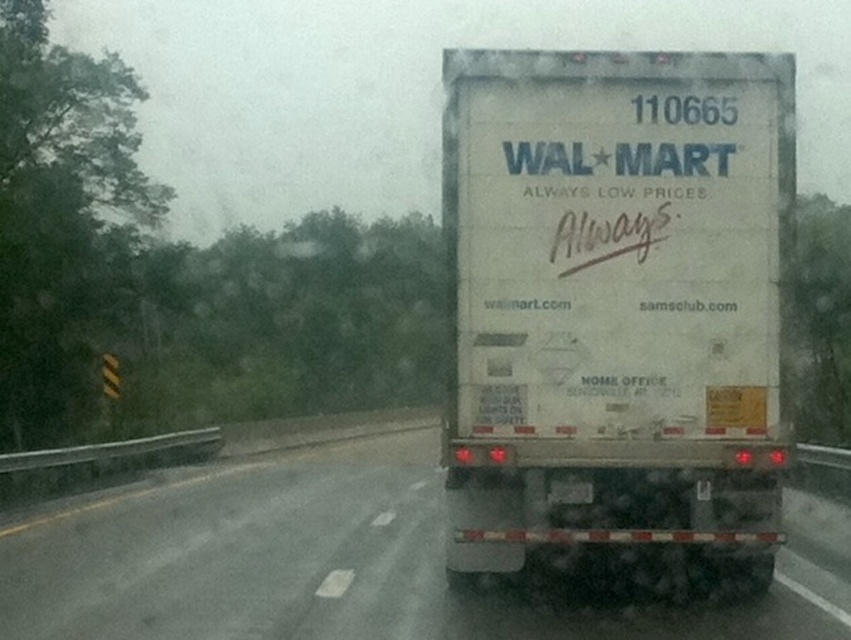
Is white matte trailer truck at center taller than white matte truck at center?

Yes, white matte trailer truck at center is taller than white matte truck at center.

Does point (683, 320) come behind point (318, 632)?

Yes, point (683, 320) is farther from viewer.

Between point (467, 456) and point (129, 637), which one is positioned in front?

Point (129, 637) is more forward.

In order to click on white matte trailer truck at center in this screenshot , I will do `click(615, 301)`.